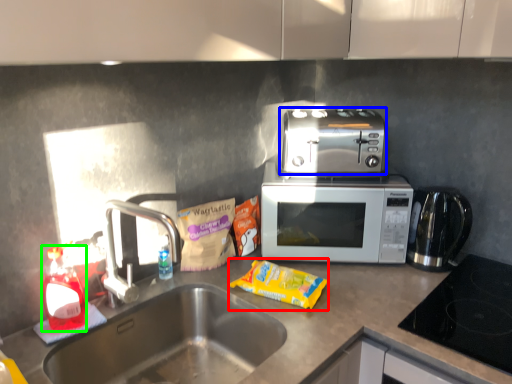
Question: Estimate the real-world distances between objects in this image. Which object is closer to snack (highlighted by a red box), toaster (highlighted by a blue box) or bottle (highlighted by a green box)?

Choices:
 (A) toaster
 (B) bottle

Answer: (A)